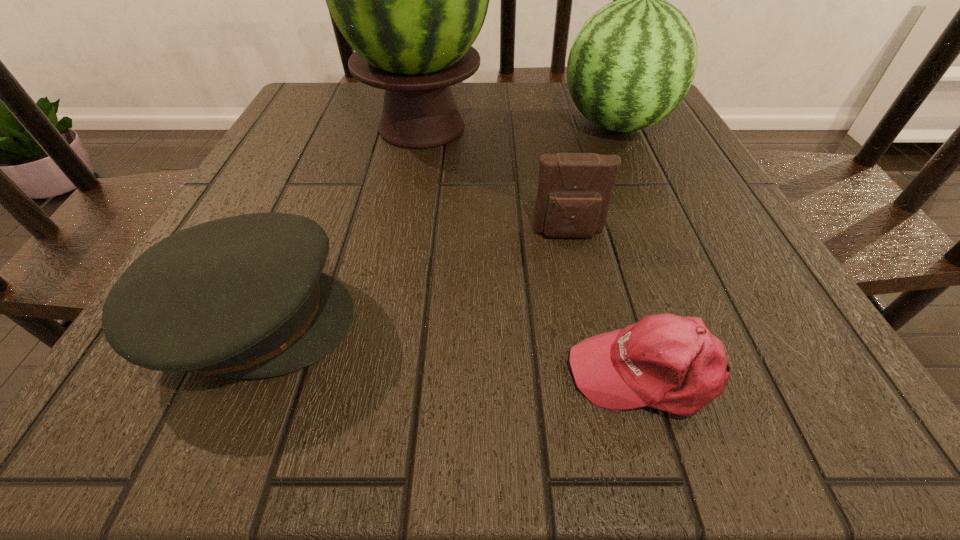
Locate an element on the screen. This screenshot has width=960, height=540. vacant region located on the front-facing side of the beret is located at coordinates (465, 320).

This screenshot has width=960, height=540. I want to click on free space located 0.210m at the front of the baseball cap with the brim, so click(x=396, y=373).

At what (x,y) coordinates should I click in order to perform the action: click on vacant position located at the front of the baseball cap with the brim. Please return your answer as a coordinate pair (x, y). The image size is (960, 540). Looking at the image, I should click on (337, 373).

The height and width of the screenshot is (540, 960). Identify the location of free spot located at the front of the baseball cap with the brim. (412, 373).

Locate an element on the screen. Image resolution: width=960 pixels, height=540 pixels. beret positioned at the near edge is located at coordinates (244, 296).

Find the location of a particular element. baseball cap that is positioned at the near edge is located at coordinates (672, 363).

Locate an element on the screen. watermelon that is at the left edge is located at coordinates (411, 0).

Locate an element on the screen. beret that is at the left edge is located at coordinates (244, 296).

Where is `watermelon situated at the right edge`? watermelon situated at the right edge is located at coordinates (x=633, y=61).

At what (x,y) coordinates should I click in order to perform the action: click on baseball cap at the right edge. Please return your answer as a coordinate pair (x, y). Looking at the image, I should click on (672, 363).